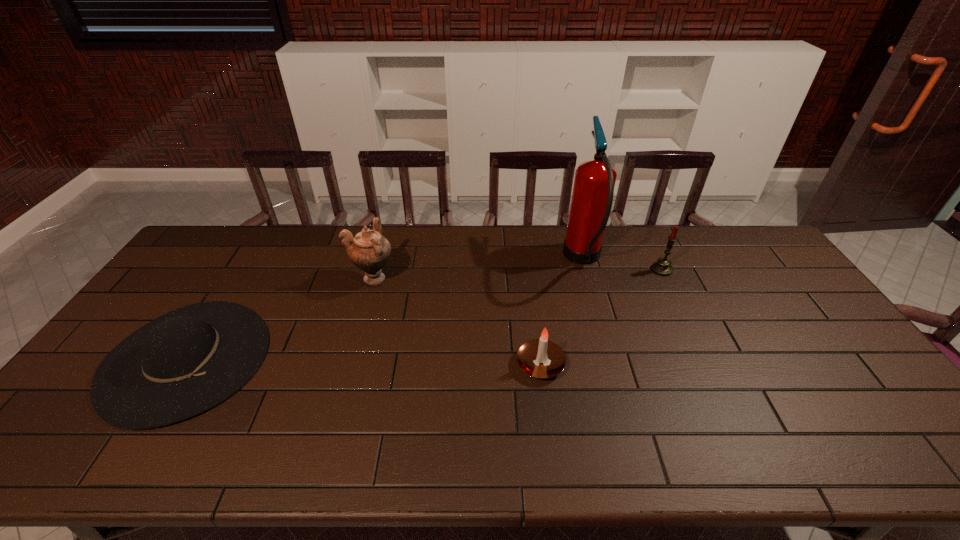
This screenshot has width=960, height=540. I want to click on vacant area that lies between the third shortest object and the fourth object from left to right, so click(622, 265).

In order to click on vacant space that's between the third shortest object and the tallest object in this screenshot , I will do `click(622, 265)`.

Locate an element on the screen. The height and width of the screenshot is (540, 960). free space between the fourth object from right to left and the tallest object is located at coordinates (478, 269).

The height and width of the screenshot is (540, 960). Find the location of `vacant area that lies between the third object from right to left and the taller candle`. vacant area that lies between the third object from right to left and the taller candle is located at coordinates (601, 316).

Locate which object is the second closest to the fire extinguisher. Please provide its 2D coordinates. Your answer should be formatted as a tuple, i.e. [(x, y)], where the tuple contains the x and y coordinates of a point satisfying the conditions above.

[(530, 355)]

At what (x,y) coordinates should I click in order to perform the action: click on the fourth closest object to the leftmost object. Please return your answer as a coordinate pair (x, y). This screenshot has width=960, height=540. Looking at the image, I should click on (662, 267).

Locate an element on the screen. This screenshot has width=960, height=540. vacant point that satisfies the following two spatial constraints: 1. on the front side of the rightmost object; 2. on the left side of the tallest object is located at coordinates (586, 269).

Locate an element on the screen. The height and width of the screenshot is (540, 960). vacant space that satisfies the following two spatial constraints: 1. on the back side of the right candle; 2. on the left side of the nearer candle is located at coordinates (528, 269).

In order to click on vacant space that satisfies the following two spatial constraints: 1. on the back side of the tallest object; 2. on the right side of the second object from left to right in this screenshot , I will do `click(379, 260)`.

What are the coordinates of `free location that satisfies the following two spatial constraints: 1. on the front-facing side of the sombrero; 2. on the right side of the left candle` in the screenshot? It's located at (183, 364).